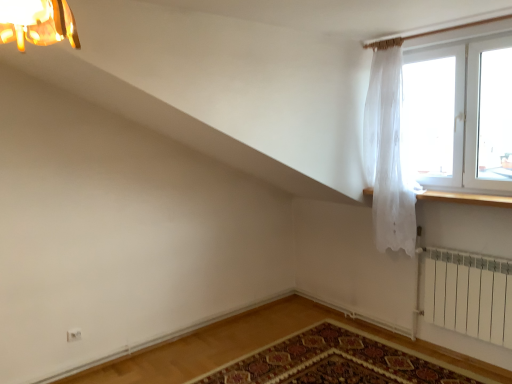
Locate an element on the screen. This screenshot has height=384, width=512. vacant space situated above white sheer curtain at upper right (from a real-world perspective) is located at coordinates (379, 36).